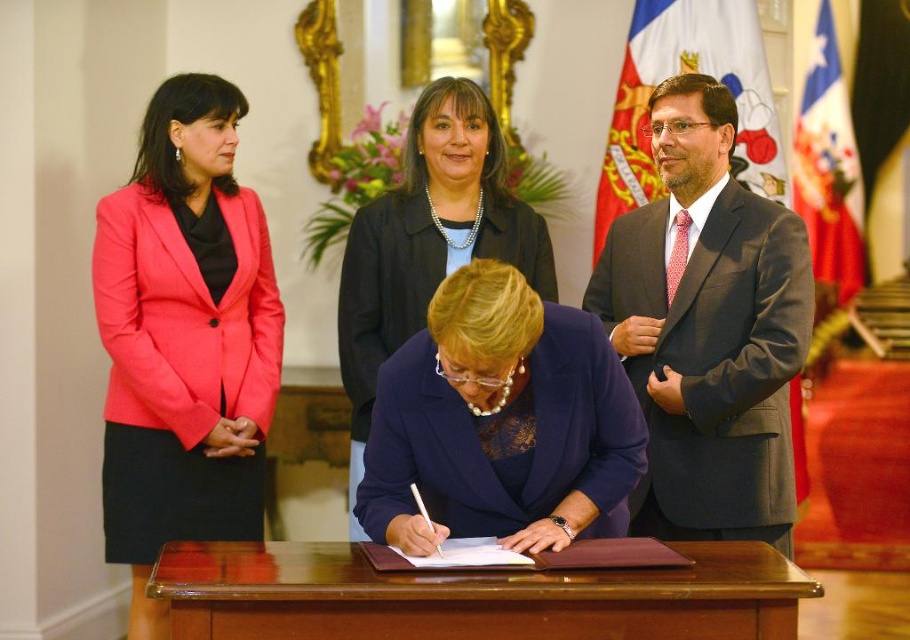
Question: Considering the real-world distances, which object is closest to the matte pink blazer at left?

Choices:
 (A) red fabric flag at upper right
 (B) white fabric flag at upper right

Answer: (B)

Question: From the image, what is the correct spatial relationship of matte pink blazer at left in relation to matte black blazer at center?

Choices:
 (A) right
 (B) left

Answer: (B)

Question: Is the position of navy blue fabric at center less distant than that of matte black blazer at center?

Choices:
 (A) yes
 (B) no

Answer: (A)

Question: Among these points, which one is farthest from the camera?

Choices:
 (A) (440, 292)
 (B) (816, 193)

Answer: (B)

Question: Which of the following is the closest to the observer?

Choices:
 (A) (211, 536)
 (B) (565, 374)
 (C) (823, 252)

Answer: (B)

Question: Does dark gray suit at right appear on the left side of white fabric flag at upper right?

Choices:
 (A) no
 (B) yes

Answer: (B)